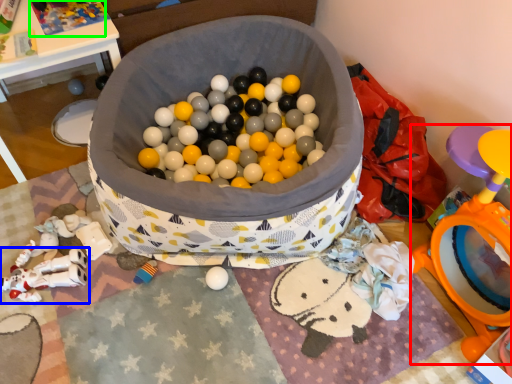
Question: Estimate the real-world distances between objects in this image. Which object is farther from toy (highlighted by a red box), toy (highlighted by a blue box) or toy (highlighted by a green box)?

Choices:
 (A) toy
 (B) toy

Answer: (B)